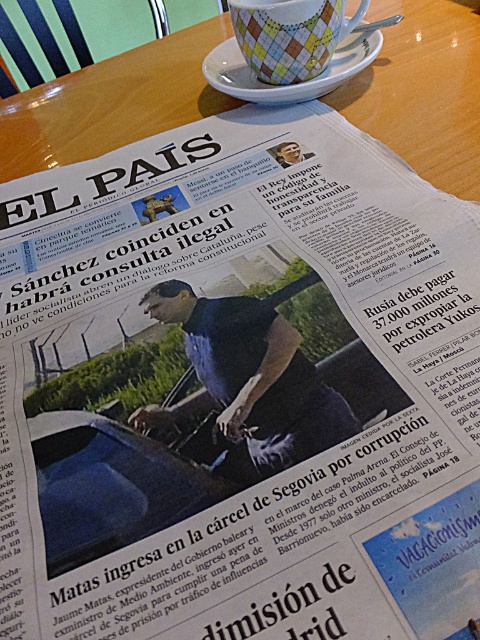
Question: Among these points, which one is nearest to the camera?

Choices:
 (A) (411, 90)
 (B) (285, 92)

Answer: (B)

Question: Which point is farther to the camera?

Choices:
 (A) white ceramic saucer at upper center
 (B) wooden table at center

Answer: (A)

Question: Can you confirm if wooden table at center is wider than white ceramic saucer at upper center?

Choices:
 (A) yes
 (B) no

Answer: (A)

Question: Is wooden table at center to the right of white ceramic saucer at upper center from the viewer's perspective?

Choices:
 (A) no
 (B) yes

Answer: (A)

Question: Does wooden table at center have a lesser width compared to white ceramic saucer at upper center?

Choices:
 (A) yes
 (B) no

Answer: (B)